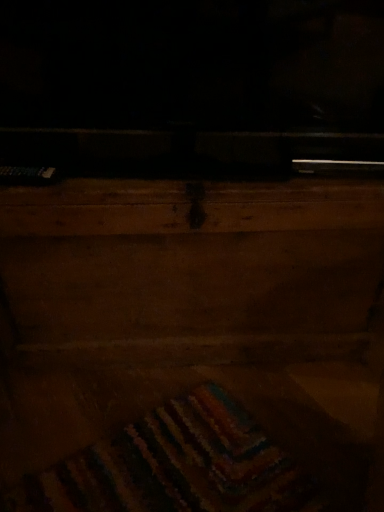
Find the location of `blank space situated above wooden rug at lower center (from a real-world perspective)`. blank space situated above wooden rug at lower center (from a real-world perspective) is located at coordinates (213, 413).